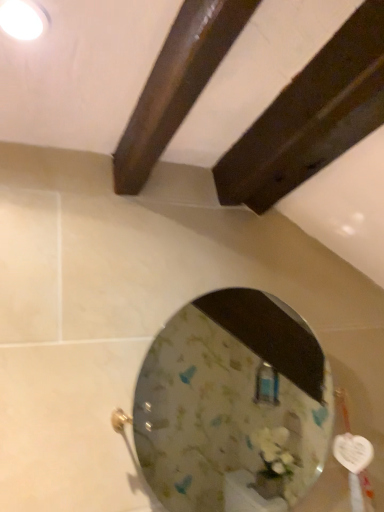
Question: Can you confirm if white glossy light fixture at upper left is positioned to the left of clear glass mirror at center?

Choices:
 (A) yes
 (B) no

Answer: (A)

Question: Is white glossy light fixture at upper left not close to clear glass mirror at center?

Choices:
 (A) yes
 (B) no

Answer: (A)

Question: Is white glossy light fixture at upper left behind clear glass mirror at center?

Choices:
 (A) yes
 (B) no

Answer: (B)

Question: Is white glossy light fixture at upper left next to clear glass mirror at center and touching it?

Choices:
 (A) yes
 (B) no

Answer: (B)

Question: From the image's perspective, would you say white glossy light fixture at upper left is positioned over clear glass mirror at center?

Choices:
 (A) yes
 (B) no

Answer: (A)

Question: From the image's perspective, is white glossy light fixture at upper left under clear glass mirror at center?

Choices:
 (A) yes
 (B) no

Answer: (B)

Question: From a real-world perspective, is clear glass mirror at center physically below white glossy light fixture at upper left?

Choices:
 (A) no
 (B) yes

Answer: (B)

Question: From the image's perspective, is clear glass mirror at center below white glossy light fixture at upper left?

Choices:
 (A) yes
 (B) no

Answer: (A)

Question: From a real-world perspective, is clear glass mirror at center on top of white glossy light fixture at upper left?

Choices:
 (A) no
 (B) yes

Answer: (A)

Question: Does clear glass mirror at center have a lesser width compared to white glossy light fixture at upper left?

Choices:
 (A) yes
 (B) no

Answer: (B)

Question: Does clear glass mirror at center have a greater width compared to white glossy light fixture at upper left?

Choices:
 (A) yes
 (B) no

Answer: (A)

Question: Is clear glass mirror at center oriented towards white glossy light fixture at upper left?

Choices:
 (A) yes
 (B) no

Answer: (B)

Question: From the image's perspective, is white glossy light fixture at upper left located above or below clear glass mirror at center?

Choices:
 (A) below
 (B) above

Answer: (B)